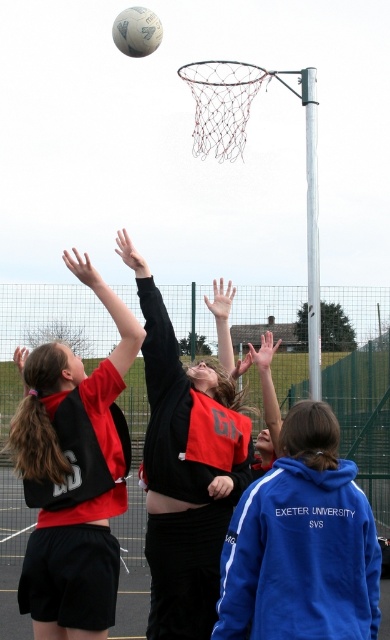
You are a referee observing the game and need to determine if the blue fleece jacket at lower right can be fully covered by the white matte volleyball at upper center. Based on their sizes, what is your conclusion?

The blue fleece jacket at lower right occupies less space than the white matte volleyball at upper center, so the volleyball can fully cover the jacket.